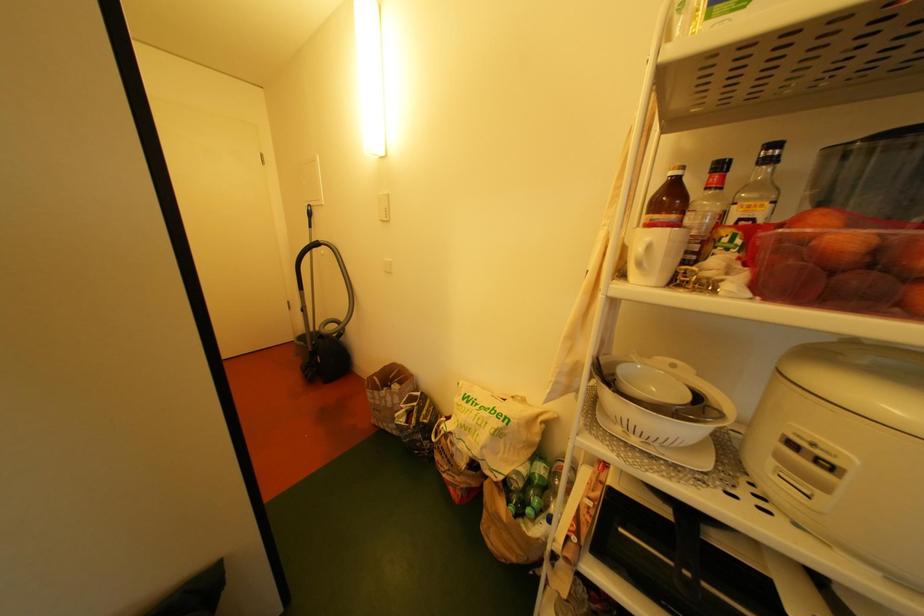
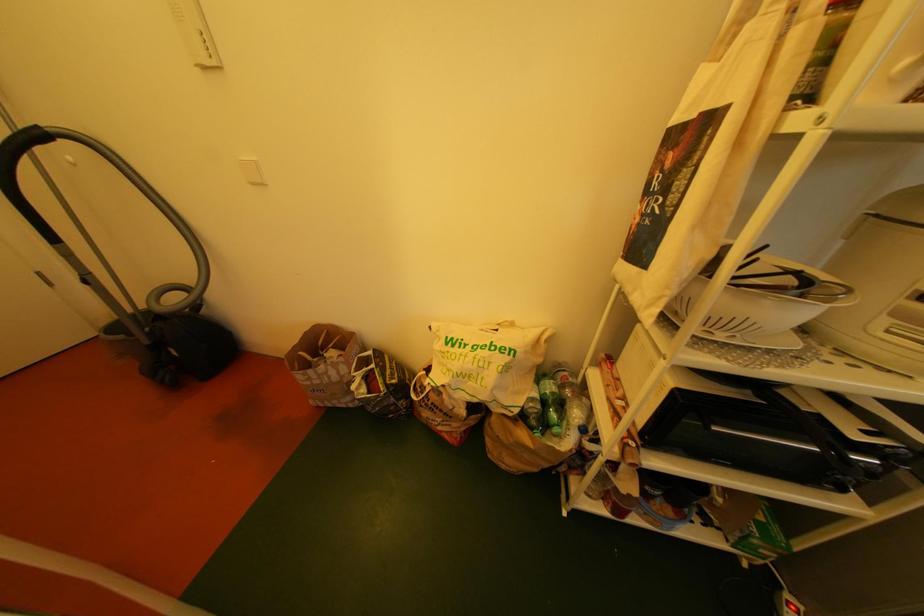
Based on the photo, first-person continuous shooting, in which direction is the camera rotating?

The camera rotated toward right-down.